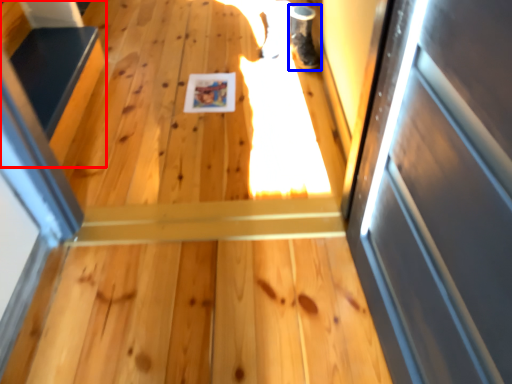
Question: Which of the following is the closest to the observer, stairs (highlighted by a red box) or shoe (highlighted by a blue box)?

Choices:
 (A) stairs
 (B) shoe

Answer: (A)